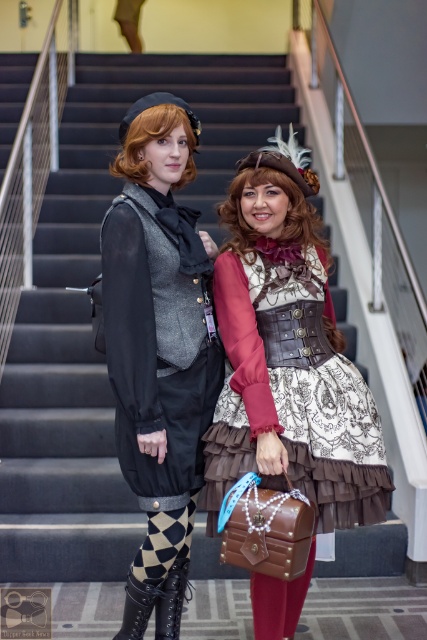
Who is lower down, white lace dress at center or black leather boot at lower center?

black leather boot at lower center

Does point (362, 429) come farther from viewer compared to point (177, 605)?

No, (362, 429) is in front of (177, 605).

At what (x,y) coordinates should I click in order to perform the action: click on white lace dress at center. Please return your answer as a coordinate pair (x, y). Looking at the image, I should click on (292, 394).

Does matte black dress at center have a greater width compared to white lace dress at center?

Yes, matte black dress at center is wider than white lace dress at center.

Does matte black dress at center appear under white lace dress at center?

Incorrect, matte black dress at center is not positioned below white lace dress at center.

Locate an element on the screen. matte black dress at center is located at coordinates 287,356.

Which is above, matte black dress at center or black leather boot at lower center?

matte black dress at center is higher up.

Based on the photo, can you confirm if matte black dress at center is smaller than black leather boot at lower center?

Actually, matte black dress at center might be larger than black leather boot at lower center.

Locate an element on the screen. The width and height of the screenshot is (427, 640). matte black dress at center is located at coordinates (287, 356).